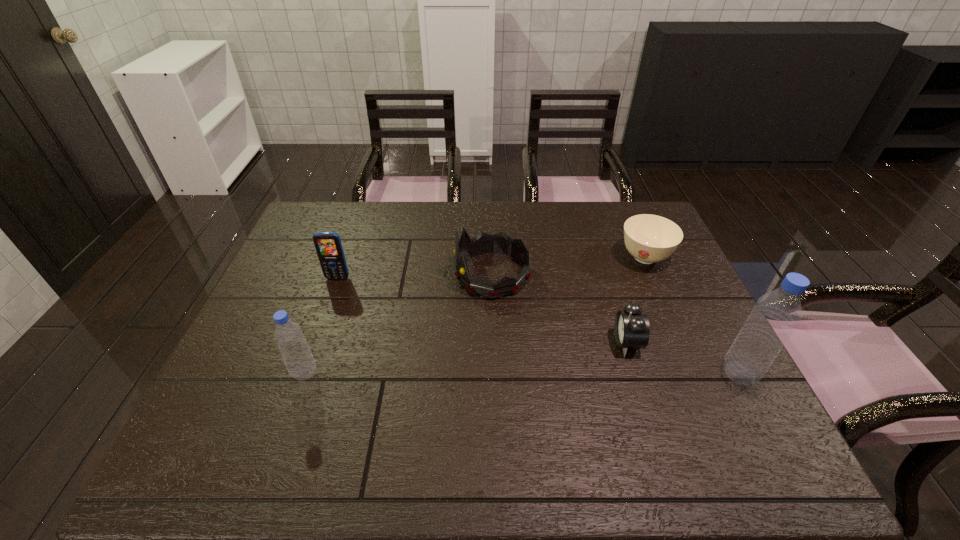
Find the location of a particular element. This screenshot has height=540, width=960. blank area located at the front of the fourth object from right to left with jewels is located at coordinates (371, 274).

Where is `free spot located 0.300m at the front of the fourth object from right to left with jewels`? The width and height of the screenshot is (960, 540). free spot located 0.300m at the front of the fourth object from right to left with jewels is located at coordinates pyautogui.click(x=353, y=274).

Locate an element on the screen. The height and width of the screenshot is (540, 960). free region located 0.270m at the front of the fourth object from right to left with jewels is located at coordinates (364, 274).

Locate an element on the screen. The width and height of the screenshot is (960, 540). vacant region located on the screen of the cellular telephone is located at coordinates (327, 308).

Where is `vacant region located on the front of the sugar bowl`? vacant region located on the front of the sugar bowl is located at coordinates (663, 299).

You are a GUI agent. You are given a task and a screenshot of the screen. Output one action in this format:
    pyautogui.click(x=<x>, y=<y>)
    Task: Click on the vacant space located on the front side of the fourth object from left to right
    
    Given the screenshot: What is the action you would take?
    pyautogui.click(x=555, y=342)

At what (x,y) coordinates should I click in order to perform the action: click on free location located on the front side of the fourth object from left to right. Please return your answer as a coordinate pair (x, y). Looking at the image, I should click on (532, 342).

Find the location of a particular element. This screenshot has width=960, height=540. free space located 0.240m on the front side of the fourth object from left to right is located at coordinates (519, 342).

At what (x,y) coordinates should I click in order to perform the action: click on object located in the far edge section of the desktop. Please return your answer as a coordinate pair (x, y). The image size is (960, 540). Looking at the image, I should click on (648, 238).

This screenshot has width=960, height=540. What are the coordinates of `object at the near edge` in the screenshot? It's located at (776, 314).